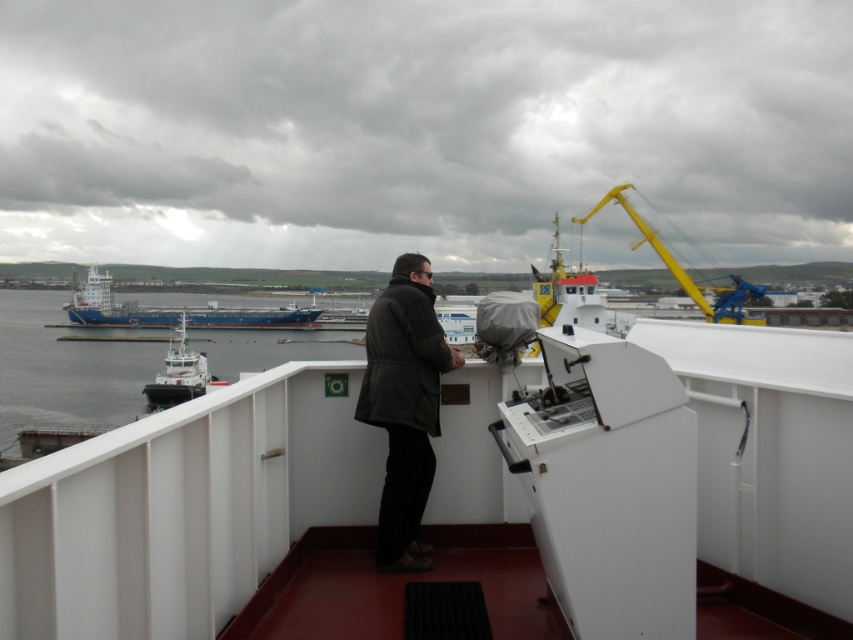
You are standing on the deck of a ship and see a point marked at coordinates (112, 305). What does this point represent?

The point at (112, 305) represents the blue matte cargo ship at left.

You are a safety inspector on the ship deck. You need to check the distance between the dark gray jacket at center and the nearest edge of the deck. The deck edge is 5 meters away from the camera. Can the jacket be safely stored within 1 meter from the deck edge for safety regulations?

The dark gray jacket at center is 4.32 meters from the camera. The deck edge is 5 meters away from the camera, so the jacket is 0.68 meters away from the edge. To comply with safety regulations, it should be stored at least 1 meter away from the edge. Therefore, the jacket is too close and needs to be moved further inward.

You are a dock worker who needs to move a container from the blue matte cargo ship at left to the white glossy tugboat at left. Your forklift has a maximum reach of 15 meters. Can you safely transfer the container without needing to move the forklift?

The distance between the blue matte cargo ship at left and the white glossy tugboat at left is 16.09 meters, which exceeds the forklifts 15 meter reach. Therefore, you cannot safely transfer the container without moving the forklift.